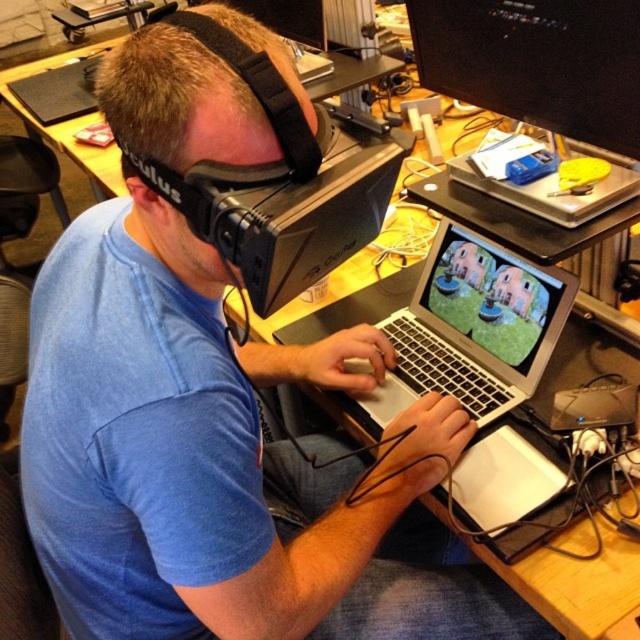
You are a technician who needs to locate the black glossy monitor at upper center in the scene. The coordinates given are point (538, 61). Can you confirm if this point corresponds to the location of the black glossy monitor at upper center?

Yes, the point (538, 61) marks the location of the black glossy monitor at upper center as described.

You are a technician who needs to adjust the distance between the black glossy monitor at upper center and the camera to 30 inches. The current distance is 28.37 inches. What should you do?

Move the black glossy monitor at upper center and the camera 0.63 inches apart to reach the desired distance of 30 inches.

You are setting up a new monitor for your home office. You have the black glossy monitor at upper center and the silver metallic laptop at center. Which of these two devices has a smaller width?

The black glossy monitor at upper center has a lesser width compared to the silver metallic laptop at center, so the black glossy monitor at upper center is smaller in width.